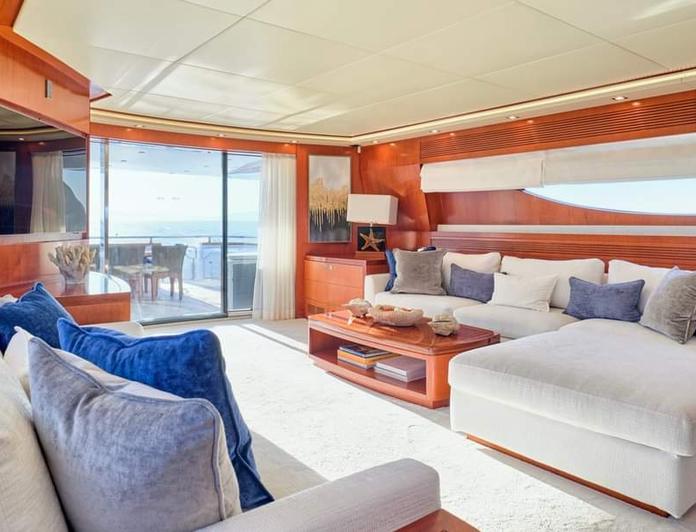
Find the location of a particular element. floor is located at coordinates (301, 412).